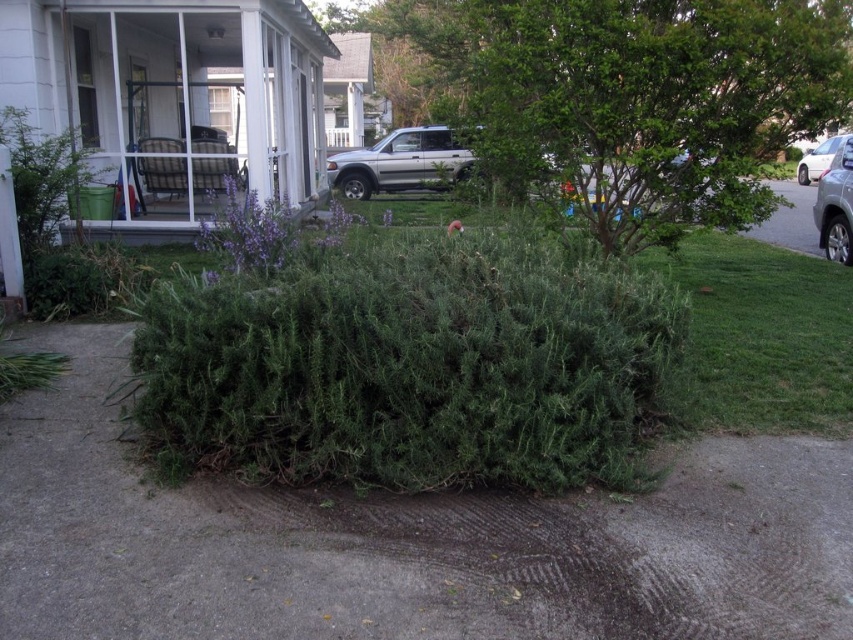
Does green needle-like bush at center have a greater height compared to silver metallic car at right?

No, green needle-like bush at center is not taller than silver metallic car at right.

Which is in front, point (602, 476) or point (843, 193)?

Point (602, 476) is in front.

Locate an element on the screen. The width and height of the screenshot is (853, 640). green needle-like bush at center is located at coordinates (408, 364).

Is green leafy tree at center behind satin silver sedan at right?

No, it is in front of satin silver sedan at right.

Which is more to the right, green leafy tree at center or satin silver sedan at right?

From the viewer's perspective, satin silver sedan at right appears more on the right side.

This screenshot has width=853, height=640. What do you see at coordinates (637, 97) in the screenshot?
I see `green leafy tree at center` at bounding box center [637, 97].

Where is `green leafy tree at center`? This screenshot has height=640, width=853. green leafy tree at center is located at coordinates (637, 97).

Can you confirm if silver metallic car at right is positioned to the right of satin silver sedan at right?

In fact, silver metallic car at right is to the left of satin silver sedan at right.

Where is `silver metallic car at right`? Image resolution: width=853 pixels, height=640 pixels. silver metallic car at right is located at coordinates click(834, 205).

The height and width of the screenshot is (640, 853). Describe the element at coordinates (834, 205) in the screenshot. I see `silver metallic car at right` at that location.

Identify the location of silver metallic car at right. (834, 205).